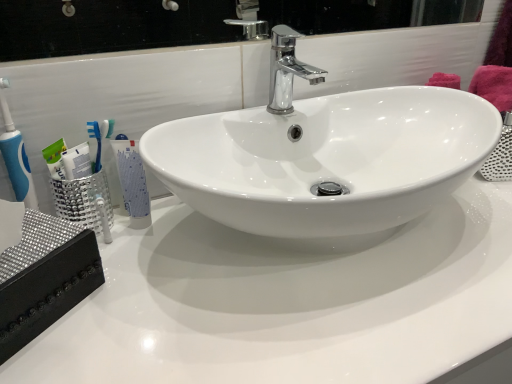
Question: Are white glossy tube at left and chrome/metallic faucet at center beside each other?

Choices:
 (A) yes
 (B) no

Answer: (B)

Question: Is white glossy tube at left positioned far away from chrome/metallic faucet at center?

Choices:
 (A) no
 (B) yes

Answer: (A)

Question: From the image's perspective, is white glossy tube at left over chrome/metallic faucet at center?

Choices:
 (A) no
 (B) yes

Answer: (A)

Question: From the image's perspective, is white glossy tube at left located beneath chrome/metallic faucet at center?

Choices:
 (A) no
 (B) yes

Answer: (B)

Question: Can you confirm if white glossy tube at left is smaller than chrome/metallic faucet at center?

Choices:
 (A) yes
 (B) no

Answer: (A)

Question: Considering the positions of white glossy tube at left and white glossy countertop at center in the image, is white glossy tube at left bigger or smaller than white glossy countertop at center?

Choices:
 (A) big
 (B) small

Answer: (B)

Question: Relative to white glossy countertop at center, is white glossy tube at left in front or behind?

Choices:
 (A) behind
 (B) front

Answer: (A)

Question: Would you say white glossy tube at left is to the left or to the right of white glossy countertop at center in the picture?

Choices:
 (A) right
 (B) left

Answer: (B)

Question: From the image's perspective, is white glossy tube at left located above or below white glossy countertop at center?

Choices:
 (A) below
 (B) above

Answer: (B)

Question: Visually, is chrome/metallic faucet at center positioned to the left or to the right of white glossy tube at left?

Choices:
 (A) right
 (B) left

Answer: (A)

Question: Considering the positions of point pyautogui.click(x=290, y=43) and point pyautogui.click(x=128, y=160), is point pyautogui.click(x=290, y=43) closer or farther from the camera than point pyautogui.click(x=128, y=160)?

Choices:
 (A) farther
 (B) closer

Answer: (A)

Question: From the image's perspective, relative to white glossy tube at left, is chrome/metallic faucet at center above or below?

Choices:
 (A) above
 (B) below

Answer: (A)

Question: From a real-world perspective, is chrome/metallic faucet at center positioned above or below white glossy tube at left?

Choices:
 (A) above
 (B) below

Answer: (A)

Question: Considering the positions of white glossy countertop at center and chrome/metallic faucet at center in the image, is white glossy countertop at center taller or shorter than chrome/metallic faucet at center?

Choices:
 (A) tall
 (B) short

Answer: (A)

Question: Visually, is white glossy countertop at center positioned to the left or to the right of chrome/metallic faucet at center?

Choices:
 (A) right
 (B) left

Answer: (A)